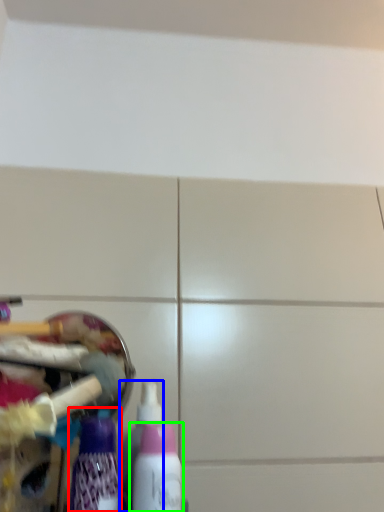
Question: Which object is the farthest from bottle (highlighted by a red box)? Choose among these: bottle (highlighted by a blue box) or bottle (highlighted by a green box).

Choices:
 (A) bottle
 (B) bottle

Answer: (A)